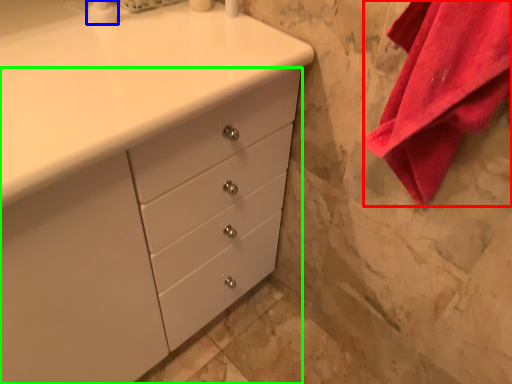
Question: Which is farther away from bath towel (highlighted by a red box)? soap dispenser (highlighted by a blue box) or chest of drawers (highlighted by a green box)?

Choices:
 (A) soap dispenser
 (B) chest of drawers

Answer: (A)